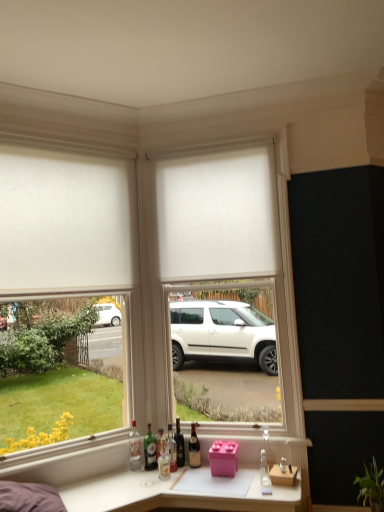
Question: Considering the relative positions of green glass bottle at lower center, which appears as the second bottle when viewed from the left, and white matte blind at center in the image provided, is green glass bottle at lower center, which appears as the second bottle when viewed from the left, to the left or to the right of white matte blind at center?

Choices:
 (A) left
 (B) right

Answer: (A)

Question: From the image's perspective, is green glass bottle at lower center, which appears as the second bottle when viewed from the left, above or below white matte blind at center?

Choices:
 (A) below
 (B) above

Answer: (A)

Question: Estimate the real-world distances between objects in this image. Which object is farther from the white matte blind at center?

Choices:
 (A) white matte window frame at center
 (B) clear glass bottle at center, which is counted as the first bottle, starting from the right
 (C) brown glass bottle at center, marked as the sixth bottle in a left-to-right arrangement
 (D) shiny dark brown bottle at center, the fifth bottle viewed from the left
 (E) clear glass bottle at lower left, positioned as the seventh bottle in right-to-left order

Answer: (B)

Question: Which of these objects is positioned farthest from the clear glass bottle at lower left, positioned as the seventh bottle in right-to-left order?

Choices:
 (A) green glass bottle at lower center, marked as the sixth bottle in a right-to-left arrangement
 (B) brown glass bottle at center, marked as the sixth bottle in a left-to-right arrangement
 (C) translucent glass bottle at center, which ranks as the fourth bottle in left-to-right order
 (D) white matte blind at center
 (E) white matte roller blind at upper left

Answer: (D)